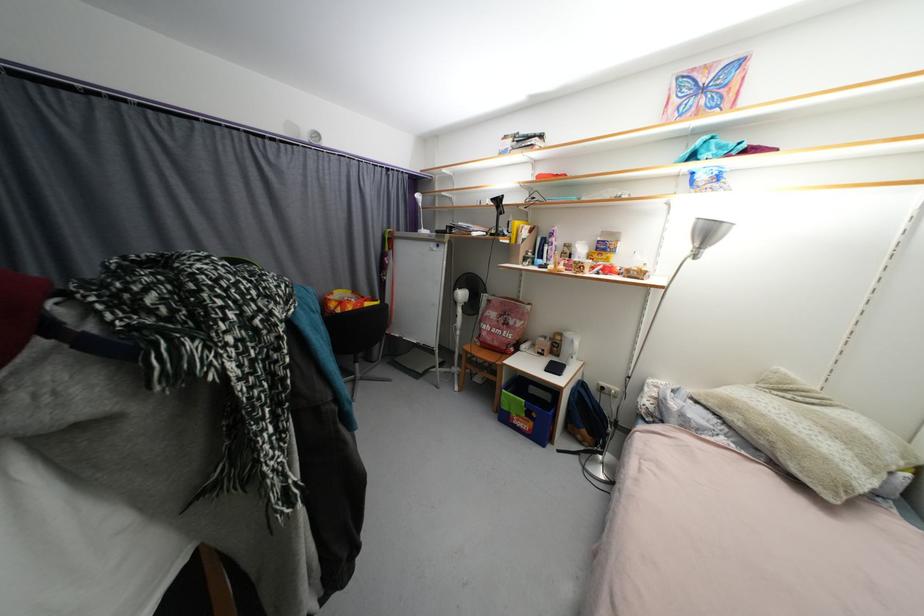
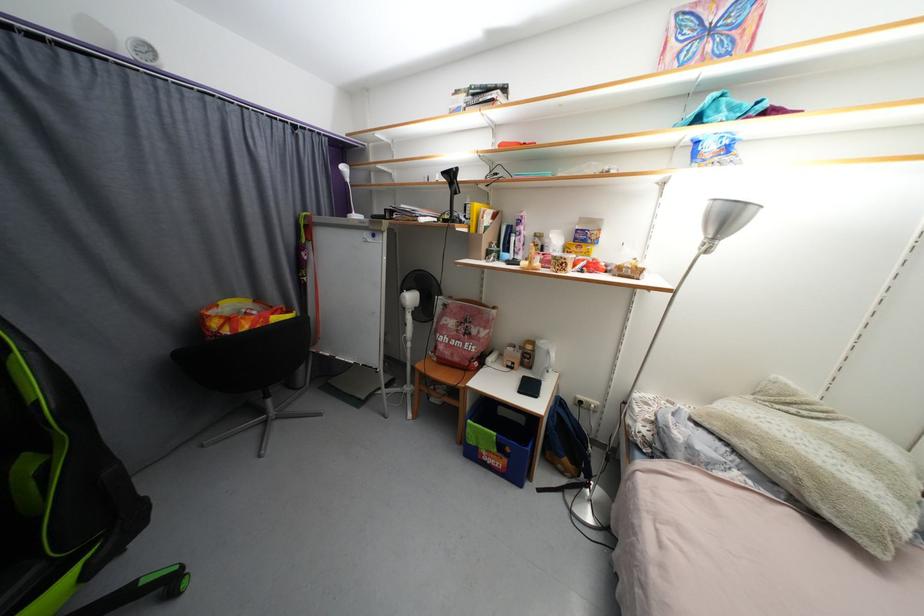
Question: The images are taken continuously from a first-person perspective. In which direction are you moving?

Choices:
 (A) Left
 (B) Right
 (C) Forward
 (D) Backward

Answer: (C)